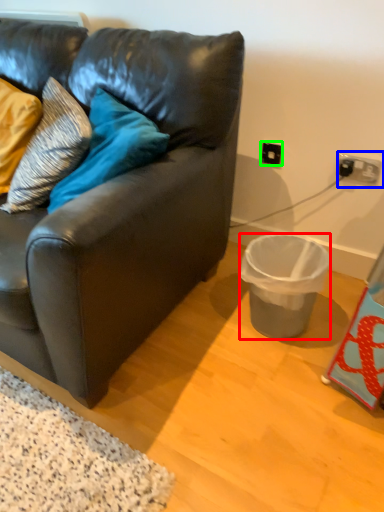
Question: Estimate the real-world distances between objects in this image. Which object is closer to trash bin/can (highlighted by a red box), power outlet (highlighted by a blue box) or electric outlet (highlighted by a green box)?

Choices:
 (A) power outlet
 (B) electric outlet

Answer: (A)